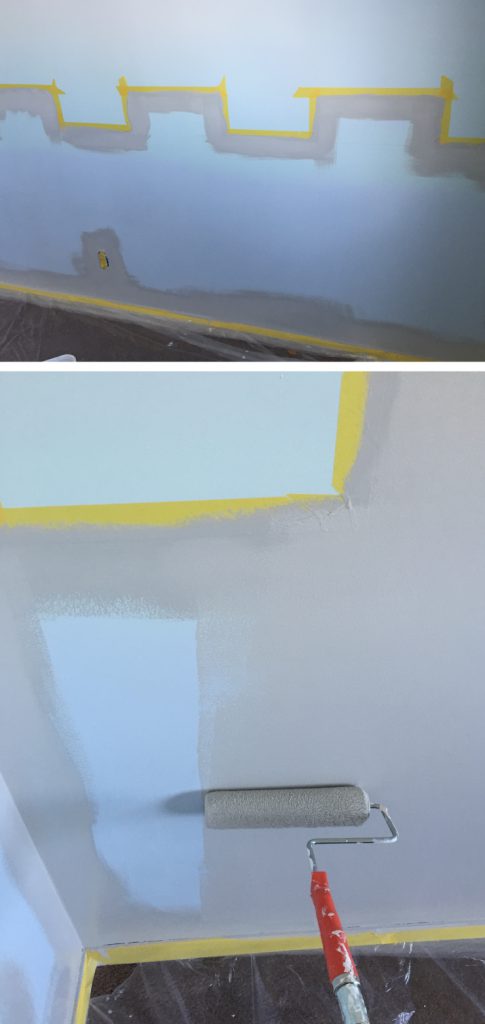
Find the location of a particular element. The image size is (485, 1024). left side corner of wall is located at coordinates (68, 916).